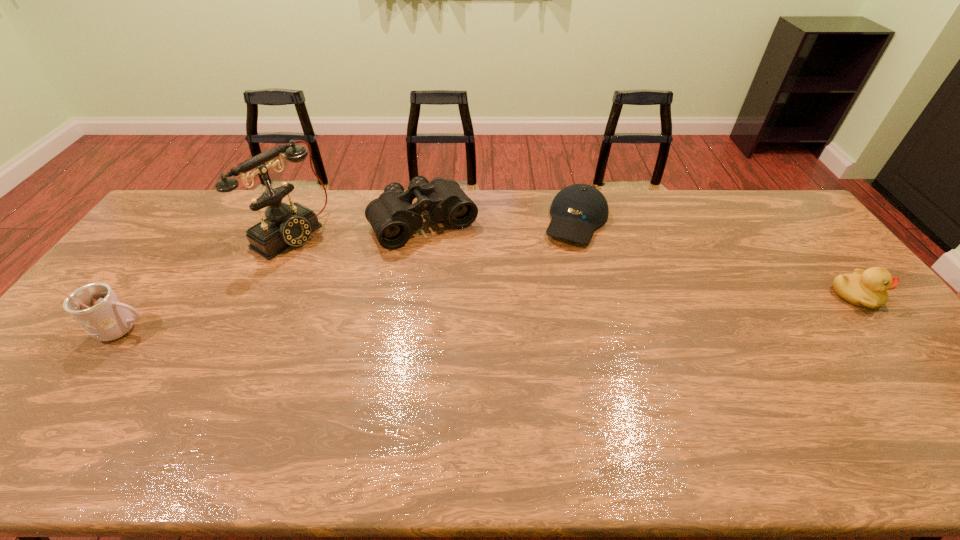
Select which object is the fourth closest to the rightmost object. Please provide its 2D coordinates. Your answer should be formatted as a tuple, i.e. [(x, y)], where the tuple contains the x and y coordinates of a point satisfying the conditions above.

[(96, 307)]

What are the coordinates of `object identified as the second closest to the second object from right to left` in the screenshot? It's located at (867, 288).

Locate an element on the screen. The image size is (960, 540). blank area in the image that satisfies the following two spatial constraints: 1. on the back side of the baseball cap; 2. on the left side of the third tallest object is located at coordinates (424, 221).

Locate an element on the screen. The height and width of the screenshot is (540, 960). blank area in the image that satisfies the following two spatial constraints: 1. on the front side of the second nearest object; 2. on the front-facing side of the telephone is located at coordinates (259, 295).

This screenshot has width=960, height=540. Identify the location of free spot that satisfies the following two spatial constraints: 1. on the front side of the rightmost object; 2. on the front-facing side of the fourth object from left to right. (595, 295).

I want to click on vacant space that satisfies the following two spatial constraints: 1. on the front side of the fourth object from left to right; 2. on the front-facing side of the fourth farthest object, so click(595, 295).